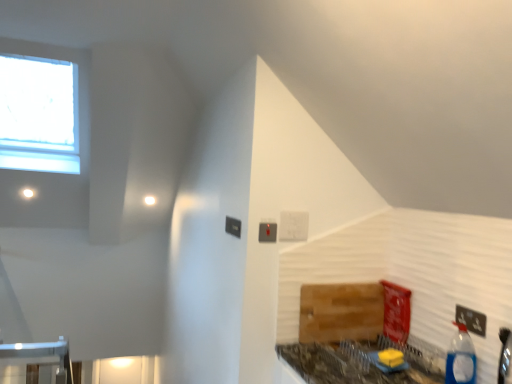
Question: From the image's perspective, would you say blue plastic bottle at lower right is shown under marble-patterned countertop at lower right?

Choices:
 (A) no
 (B) yes

Answer: (A)

Question: From a real-world perspective, is blue plastic bottle at lower right under marble-patterned countertop at lower right?

Choices:
 (A) no
 (B) yes

Answer: (A)

Question: Can you confirm if blue plastic bottle at lower right is positioned to the right of marble-patterned countertop at lower right?

Choices:
 (A) no
 (B) yes

Answer: (B)

Question: Considering the relative positions of blue plastic bottle at lower right and marble-patterned countertop at lower right in the image provided, is blue plastic bottle at lower right in front of marble-patterned countertop at lower right?

Choices:
 (A) no
 (B) yes

Answer: (A)

Question: Is blue plastic bottle at lower right taller than marble-patterned countertop at lower right?

Choices:
 (A) yes
 (B) no

Answer: (A)

Question: Is blue plastic bottle at lower right behind marble-patterned countertop at lower right?

Choices:
 (A) yes
 (B) no

Answer: (A)

Question: Is marble-patterned countertop at lower right outside black plastic electric outlet at lower right?

Choices:
 (A) no
 (B) yes

Answer: (B)

Question: Can you confirm if marble-patterned countertop at lower right is thinner than black plastic electric outlet at lower right?

Choices:
 (A) no
 (B) yes

Answer: (A)

Question: From a real-world perspective, is marble-patterned countertop at lower right physically below black plastic electric outlet at lower right?

Choices:
 (A) no
 (B) yes

Answer: (B)

Question: From a real-world perspective, is marble-patterned countertop at lower right positioned over black plastic electric outlet at lower right based on gravity?

Choices:
 (A) no
 (B) yes

Answer: (A)

Question: Can you confirm if marble-patterned countertop at lower right is taller than black plastic electric outlet at lower right?

Choices:
 (A) yes
 (B) no

Answer: (B)

Question: From the image's perspective, is marble-patterned countertop at lower right on top of black plastic electric outlet at lower right?

Choices:
 (A) no
 (B) yes

Answer: (A)

Question: Is blue plastic bottle at lower right facing away from black plastic electric outlet at lower right?

Choices:
 (A) no
 (B) yes

Answer: (A)